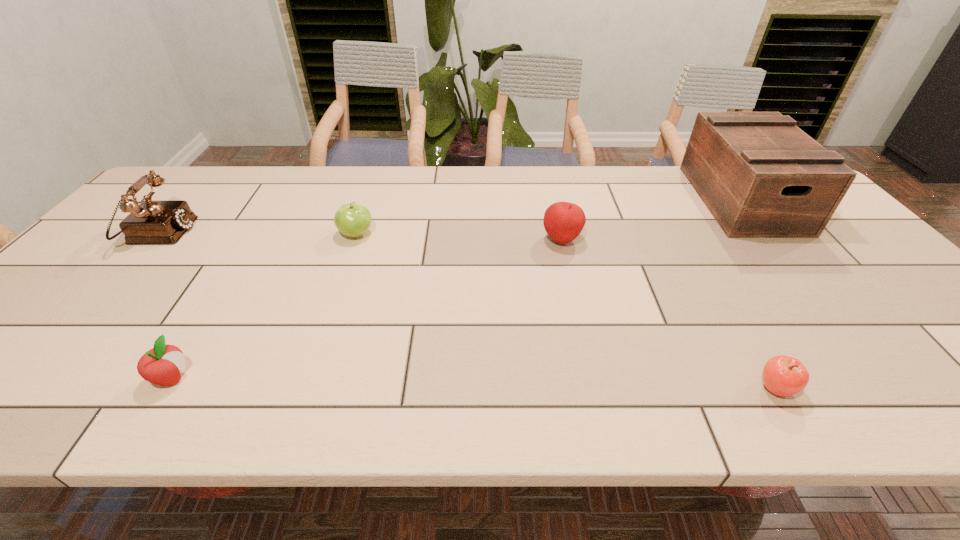
This screenshot has width=960, height=540. Identify the location of vacant space positioned 0.220m on the back of the third object from right to left. (550, 188).

I want to click on blank space located on the right of the fourth object from right to left, so click(x=501, y=234).

At what (x,y) coordinates should I click in order to perform the action: click on free spot located 0.170m on the back of the leftmost apple. Please return your answer as a coordinate pair (x, y). Image resolution: width=960 pixels, height=540 pixels. Looking at the image, I should click on (218, 304).

At what (x,y) coordinates should I click in order to perform the action: click on blank area located on the back of the rightmost apple. Please return your answer as a coordinate pair (x, y). Image resolution: width=960 pixels, height=540 pixels. Looking at the image, I should click on (716, 286).

What are the coordinates of `object that is at the far edge` in the screenshot? It's located at (760, 176).

Where is `object located at the left edge`? object located at the left edge is located at coordinates (152, 222).

The width and height of the screenshot is (960, 540). Find the location of `object present at the right edge`. object present at the right edge is located at coordinates (760, 176).

Identify the location of object that is at the far right corner. (760, 176).

What are the coordinates of `vacant space at the far edge` in the screenshot? It's located at (473, 168).

Where is `free space at the near edge of the desktop`? This screenshot has height=540, width=960. free space at the near edge of the desktop is located at coordinates (939, 406).